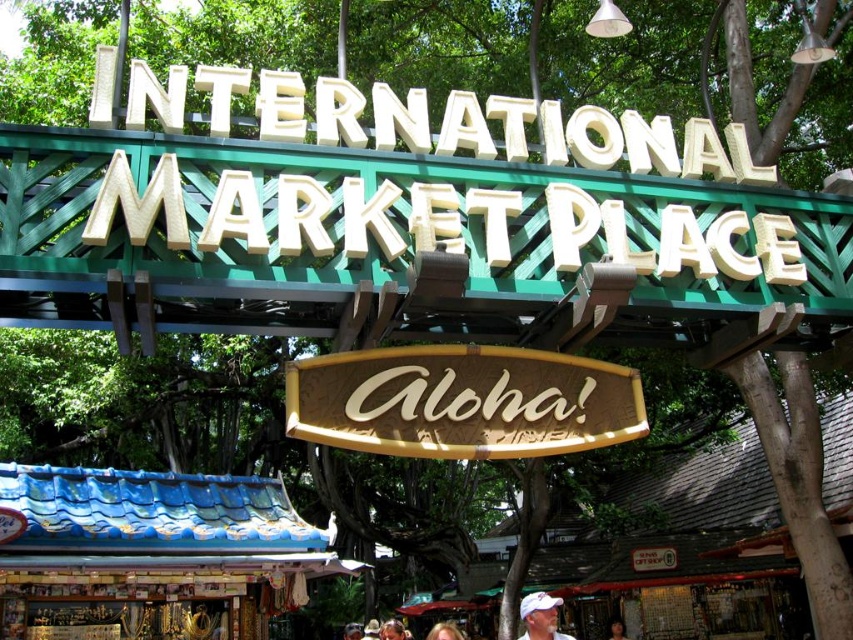
You are standing at the entrance of the International Marketplace and see both the wooden signboard at center and the brown leather hat at center. Which object appears smaller in size?

The wooden signboard at center is smaller than the brown leather hat at center.

You are standing at the entrance of the International Marketplace and want to take a photo of the wooden signboard at center. To avoid blocking the view, you need to move to the side opposite of the blonde hair at lower center. Which direction should you move?

The wooden signboard at center is to the right of blonde hair at lower center. To avoid blocking the view, you should move to the left side of the blonde hair at lower center.

You are a photographer at the International Marketplace entrance. You want to capture a photo that includes both the blonde hair at lower center and the smooth brown hair at center. Based on their positions, which hair should you focus on first to ensure both are in frame?

The blonde hair at lower center is in front of the smooth brown hair at center. To ensure both are in frame, focus on the blonde hair at lower center first as it is closer to the camera, allowing the background subject to remain in focus.